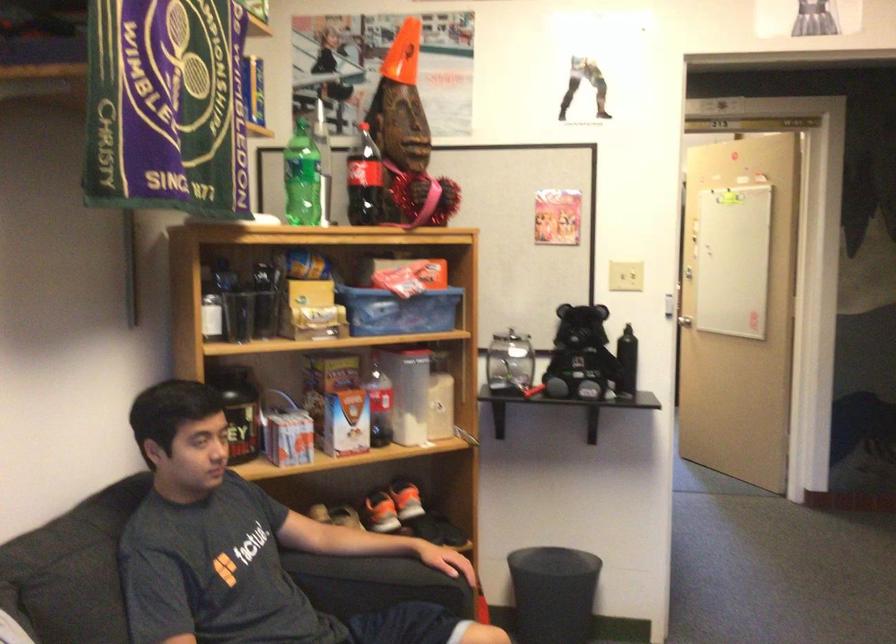
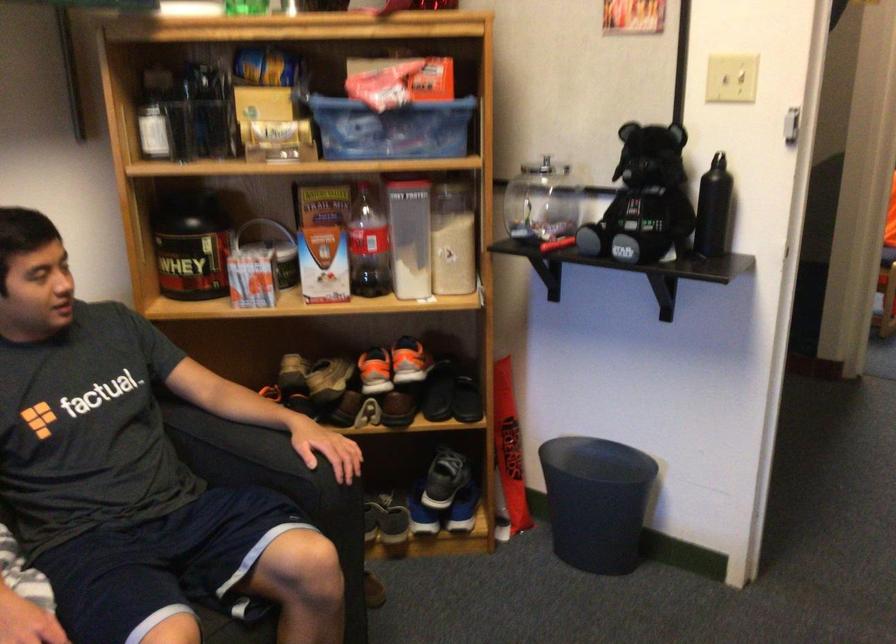
Find the pixel in the second image that matches (445,351) in the first image.

(455, 184)